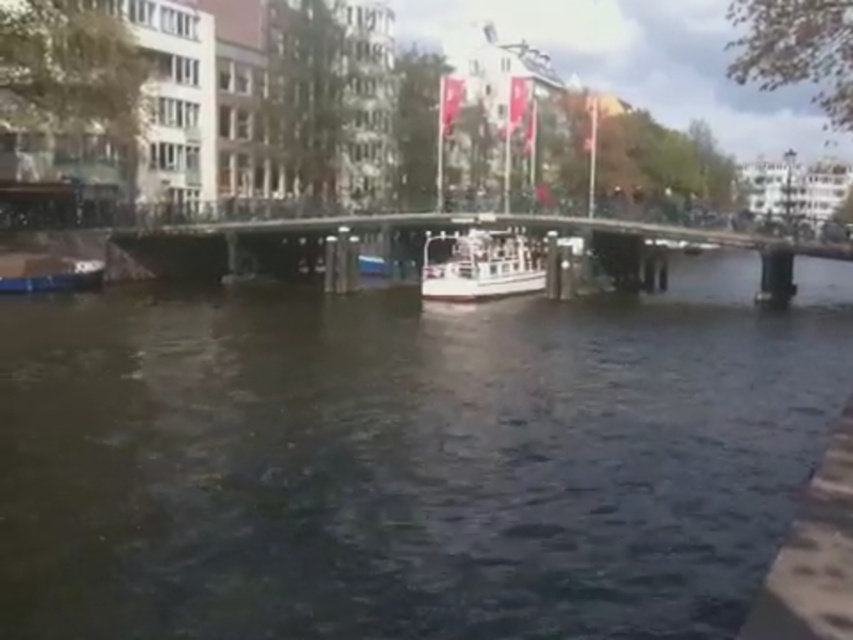
Between dark water at center and white glossy boat at center, which one is positioned lower?

dark water at center

Can you confirm if dark water at center is thinner than white glossy boat at center?

Incorrect, dark water at center's width is not less than white glossy boat at center's.

What do you see at coordinates (409, 456) in the screenshot?
I see `dark water at center` at bounding box center [409, 456].

I want to click on dark water at center, so click(409, 456).

The width and height of the screenshot is (853, 640). Find the location of `dark water at center`. dark water at center is located at coordinates click(x=409, y=456).

Is dark water at center to the left of metallic silver boat at left from the viewer's perspective?

No, dark water at center is not to the left of metallic silver boat at left.

Where is `dark water at center`? Image resolution: width=853 pixels, height=640 pixels. dark water at center is located at coordinates (409, 456).

Does dark water at center have a greater height compared to white painted steel bridge at center?

Correct, dark water at center is much taller as white painted steel bridge at center.

Who is lower down, dark water at center or white painted steel bridge at center?

dark water at center

Between point (805, 324) and point (398, 218), which one is positioned behind?

Point (398, 218)

What are the coordinates of `dark water at center` in the screenshot? It's located at coord(409,456).